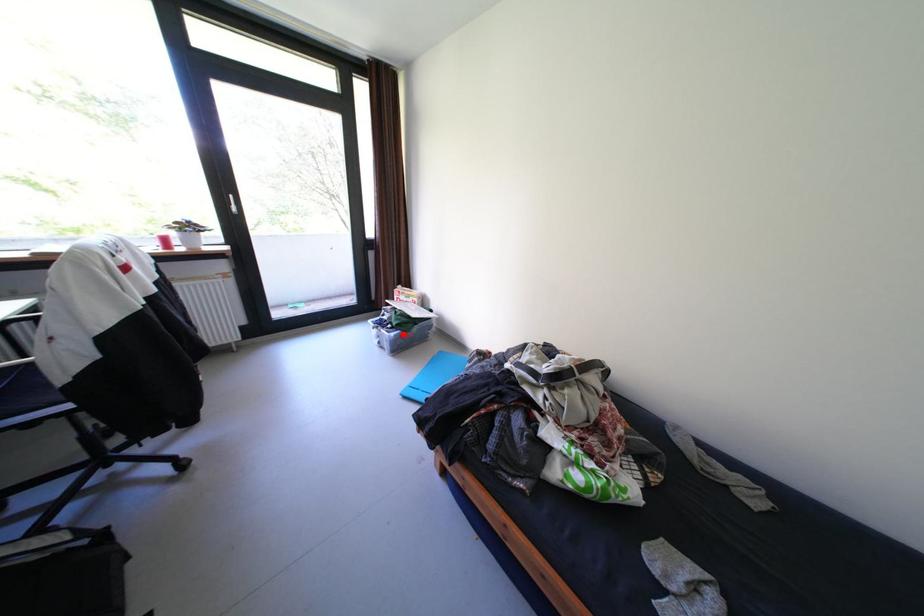
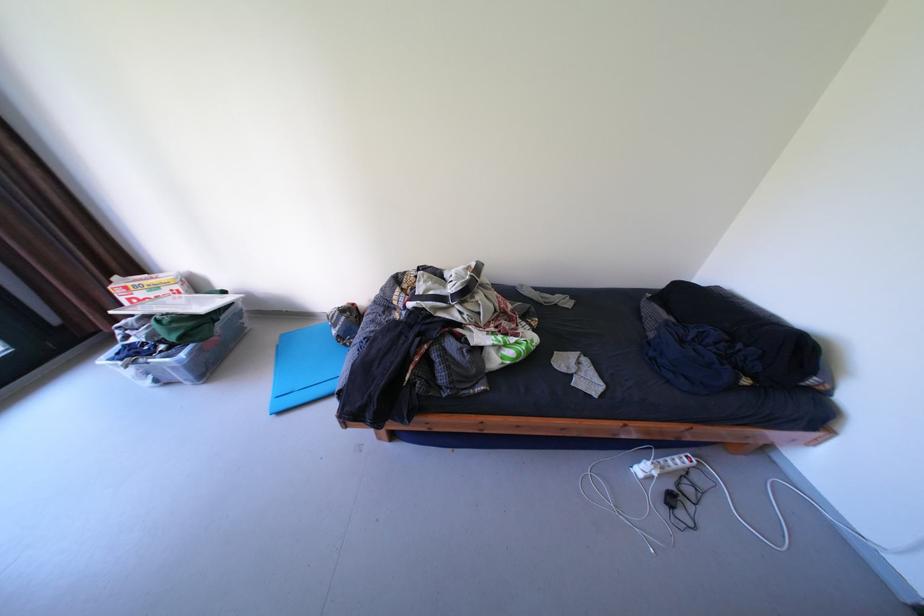
The point at the highlighted location is marked in the first image. Where is the corresponding point in the second image?

(193, 355)